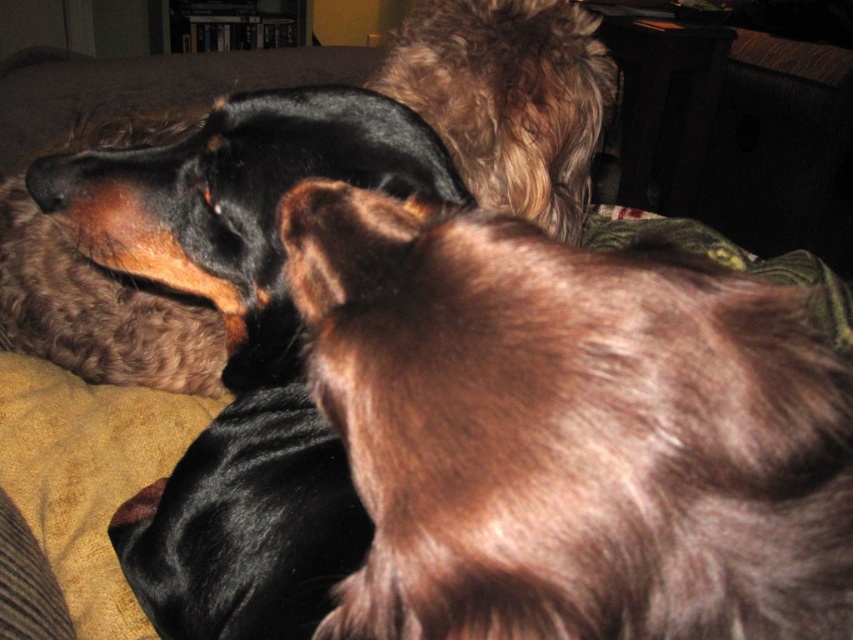
Describe the element at coordinates (242, 348) in the screenshot. This screenshot has height=640, width=853. I see `shiny black coat at upper left` at that location.

Which is behind, point (173, 228) or point (502, 33)?

The point (502, 33) is behind.

In order to click on shiny black coat at upper left in this screenshot , I will do `click(242, 348)`.

You are a GUI agent. You are given a task and a screenshot of the screen. Output one action in this format:
    pyautogui.click(x=<x>, y=<y>)
    Task: Click on the shiny black coat at upper left
    This screenshot has height=640, width=853.
    Given the screenshot: What is the action you would take?
    pyautogui.click(x=242, y=348)